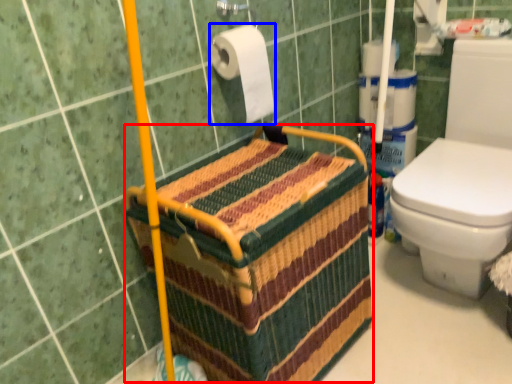
Question: Which object is further to the camera taking this photo, basket (highlighted by a red box) or toilet paper (highlighted by a blue box)?

Choices:
 (A) basket
 (B) toilet paper

Answer: (B)